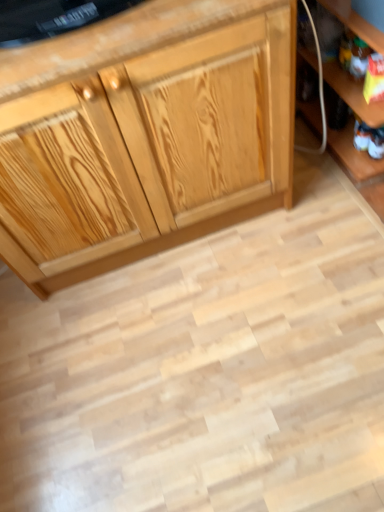
What are the coordinates of `white fabric toy at lower right` in the screenshot? It's located at (369, 139).

What is the approximate height of natural wood cabinet at center?

natural wood cabinet at center is 79.82 centimeters in height.

Locate an element on the screen. This screenshot has width=384, height=512. wooden shelf at lower right is located at coordinates [353, 94].

Which of these two, white fabric toy at lower right or wooden shelf at lower right, is thinner?

Thinner between the two is white fabric toy at lower right.

Which of these two, white fabric toy at lower right or wooden shelf at lower right, stands taller?

wooden shelf at lower right.

Based on the photo, from the image's perspective, who appears lower, white fabric toy at lower right or wooden shelf at lower right?

white fabric toy at lower right is shown below in the image.

Is the depth of white fabric toy at lower right less than that of wooden shelf at lower right?

That is False.

Is white fabric toy at lower right located within natural wood cabinet at center?

No, white fabric toy at lower right is not inside natural wood cabinet at center.

From the image's perspective, is natural wood cabinet at center located above or below white fabric toy at lower right?

Based on their image positions, natural wood cabinet at center is located above white fabric toy at lower right.

Is there a large distance between natural wood cabinet at center and white fabric toy at lower right?

natural wood cabinet at center is actually quite close to white fabric toy at lower right.

The image size is (384, 512). In order to click on toy on the right of natural wood cabinet at center in this screenshot , I will do `click(369, 139)`.

Who is shorter, white fabric toy at lower right or natural wood cabinet at center?

white fabric toy at lower right is shorter.

The height and width of the screenshot is (512, 384). Find the location of `cabinetry above the white fabric toy at lower right (from the image's perspective)`. cabinetry above the white fabric toy at lower right (from the image's perspective) is located at coordinates coord(147,140).

In the scene shown: From a real-world perspective, is white fabric toy at lower right over natural wood cabinet at center?

No, from a real-world perspective, white fabric toy at lower right is not above natural wood cabinet at center.

Which object is positioned more to the left, white fabric toy at lower right or natural wood cabinet at center?

Positioned to the left is natural wood cabinet at center.

Is wooden shelf at lower right positioned beyond the bounds of white fabric toy at lower right?

Absolutely, wooden shelf at lower right is external to white fabric toy at lower right.

From a real-world perspective, is wooden shelf at lower right below white fabric toy at lower right?

Actually, wooden shelf at lower right is physically above white fabric toy at lower right in the real world.

Can you confirm if wooden shelf at lower right is thinner than white fabric toy at lower right?

In fact, wooden shelf at lower right might be wider than white fabric toy at lower right.

In the scene shown: Are wooden shelf at lower right and white fabric toy at lower right located far from each other?

They are positioned close to each other.

Is wooden shelf at lower right touching natural wood cabinet at center?

No, wooden shelf at lower right is not with natural wood cabinet at center.

From a real-world perspective, who is located lower, wooden shelf at lower right or natural wood cabinet at center?

wooden shelf at lower right.

Is wooden shelf at lower right wider or thinner than natural wood cabinet at center?

Considering their sizes, wooden shelf at lower right looks broader than natural wood cabinet at center.

Is wooden shelf at lower right not within natural wood cabinet at center?

Yes, wooden shelf at lower right is located beyond the bounds of natural wood cabinet at center.

Does natural wood cabinet at center appear on the right side of wooden shelf at lower right?

Incorrect, natural wood cabinet at center is not on the right side of wooden shelf at lower right.

Is wooden shelf at lower right completely or partially inside natural wood cabinet at center?

No, wooden shelf at lower right is not a part of natural wood cabinet at center.

From a real-world perspective, does natural wood cabinet at center sit lower than wooden shelf at lower right?

No, from a real-world perspective, natural wood cabinet at center is not beneath wooden shelf at lower right.

Identify the location of shelf in front of the white fabric toy at lower right. (353, 94).

Identify the location of toy behind the natural wood cabinet at center. (369, 139).

Which object lies nearer to the anchor point white fabric toy at lower right, natural wood cabinet at center or wooden shelf at lower right?

wooden shelf at lower right is positioned closer to the anchor white fabric toy at lower right.

When comparing their distances from wooden shelf at lower right, does white fabric toy at lower right or natural wood cabinet at center seem further?

natural wood cabinet at center lies further to wooden shelf at lower right than the other object.

Looking at the image, which one is located further to wooden shelf at lower right, natural wood cabinet at center or white fabric toy at lower right?

natural wood cabinet at center.

Which object lies further to the anchor point natural wood cabinet at center, white fabric toy at lower right or wooden shelf at lower right?

white fabric toy at lower right.

Estimate the real-world distances between objects in this image. Which object is further from natural wood cabinet at center, wooden shelf at lower right or white fabric toy at lower right?

white fabric toy at lower right is positioned further to the anchor natural wood cabinet at center.

When comparing their distances from white fabric toy at lower right, does wooden shelf at lower right or natural wood cabinet at center seem further?

natural wood cabinet at center is further to white fabric toy at lower right.

Image resolution: width=384 pixels, height=512 pixels. Identify the location of toy between natural wood cabinet at center and wooden shelf at lower right in the horizontal direction. (369, 139).